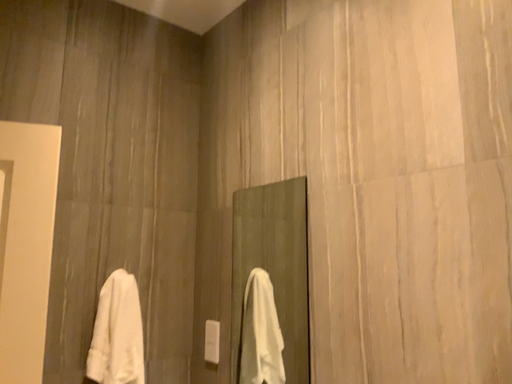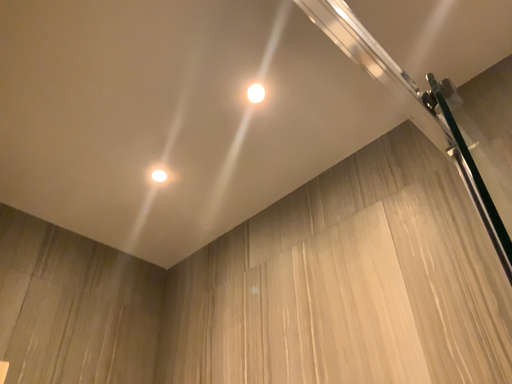
Question: Which way did the camera rotate in the video?

Choices:
 (A) rotated upward
 (B) rotated downward

Answer: (A)